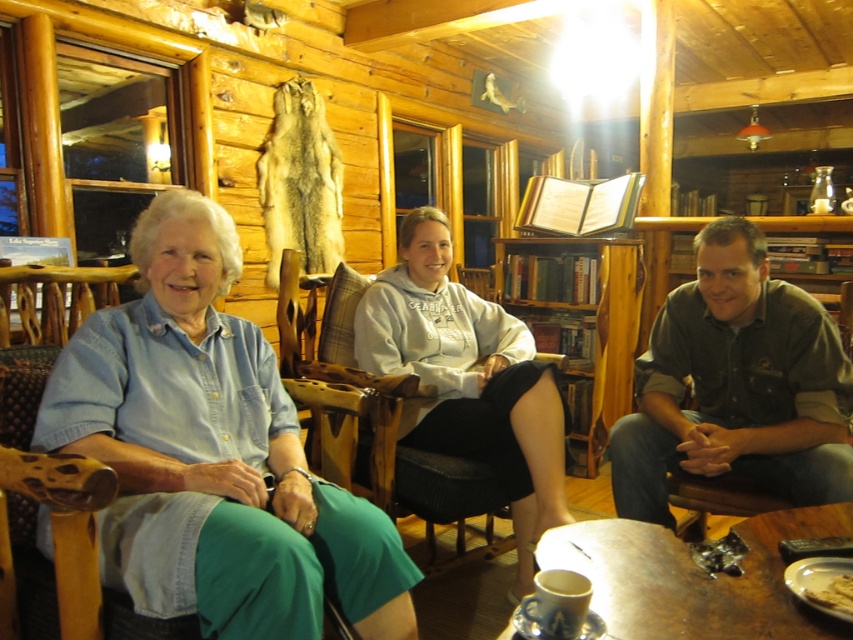
Does denim shirt at left lie in front of golden crispy bread at lower right?

No.

Between point (222, 230) and point (834, 596), which one is positioned behind?

The point (222, 230) is more distant.

The width and height of the screenshot is (853, 640). In order to click on denim shirt at left in this screenshot , I will do `click(213, 454)`.

The width and height of the screenshot is (853, 640). In order to click on denim shirt at left in this screenshot , I will do `click(213, 454)`.

Consider the image. Does wooden bookshelf at center have a lesser height compared to golden crispy bread at lower right?

No.

What do you see at coordinates (593, 323) in the screenshot? The image size is (853, 640). I see `wooden bookshelf at center` at bounding box center [593, 323].

Locate an element on the screen. The height and width of the screenshot is (640, 853). wooden bookshelf at center is located at coordinates (593, 323).

Is point (793, 497) farther from camera compared to point (595, 428)?

No, it is not.

Is dark green shirt at center positioned in front of wooden bookshelf at center?

Yes, dark green shirt at center is in front of wooden bookshelf at center.

Does point (699, 305) come behind point (634, 262)?

No, it is in front of (634, 262).

Where is `dark green shirt at center`? This screenshot has height=640, width=853. dark green shirt at center is located at coordinates (735, 385).